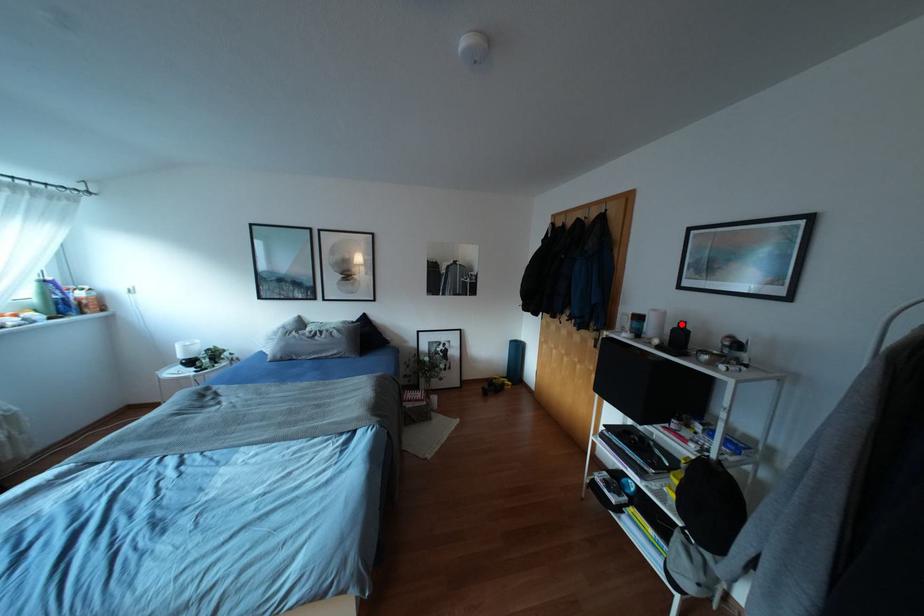
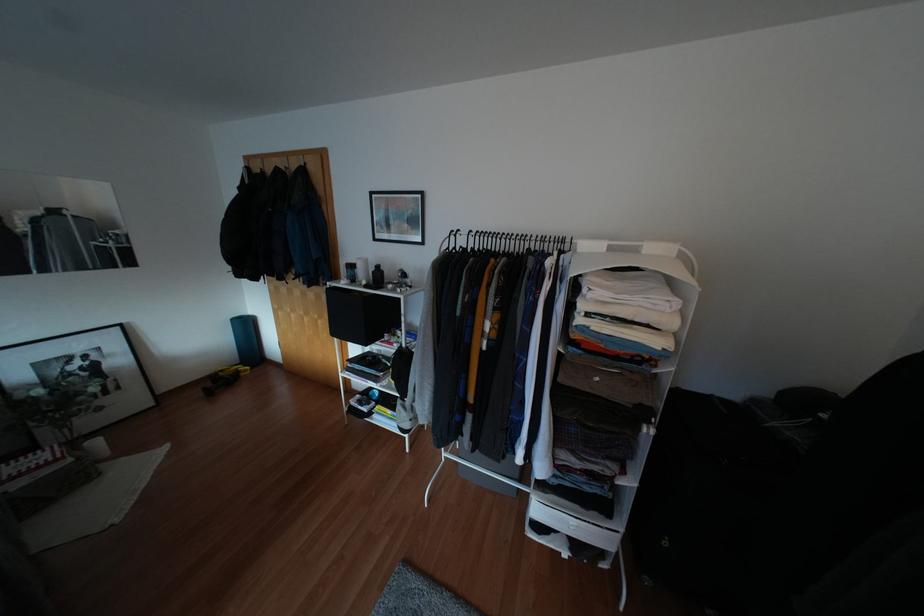
Where in the second image is the point corresponding to the highlighted location from the first image?

(377, 265)